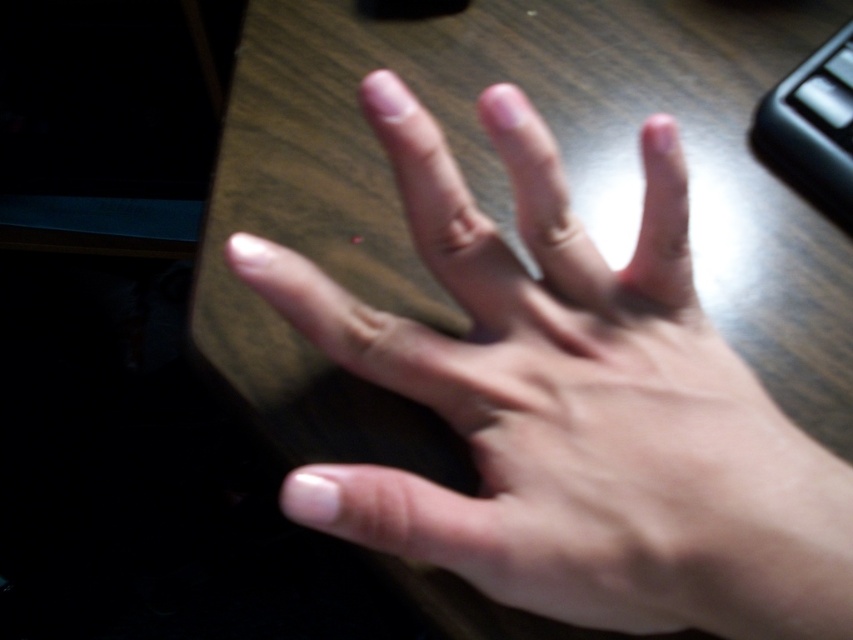
Does smooth skin hand at center appear over black plastic keyboard at upper right?

No, smooth skin hand at center is not above black plastic keyboard at upper right.

Does smooth skin hand at center have a greater height compared to black plastic keyboard at upper right?

Yes.

What do you see at coordinates (572, 406) in the screenshot? I see `smooth skin hand at center` at bounding box center [572, 406].

Where is `smooth skin hand at center`? The height and width of the screenshot is (640, 853). smooth skin hand at center is located at coordinates (572, 406).